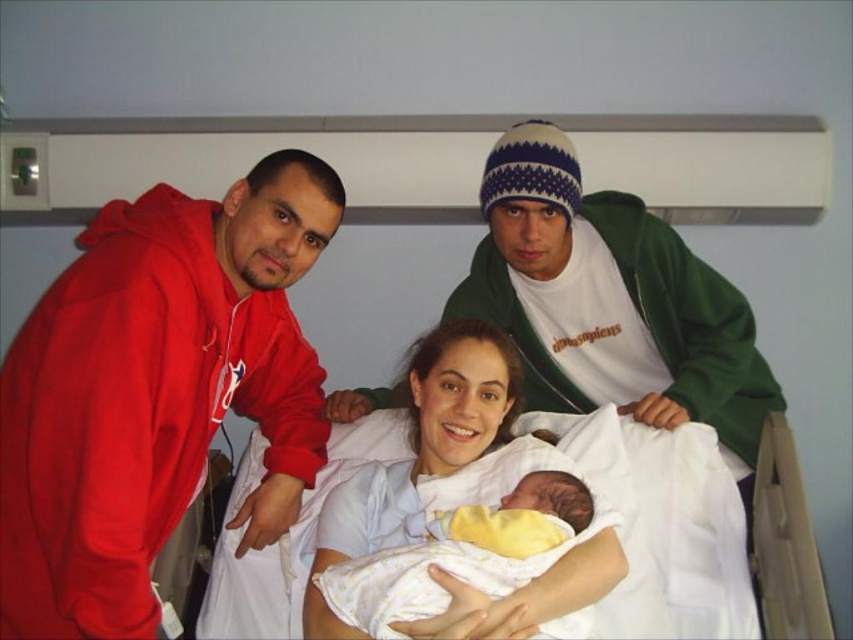
Question: Which point is farther to the camera?

Choices:
 (A) matte red hoodie at left
 (B) white fabric at center
 (C) yellow soft fabric newborn at center

Answer: (B)

Question: Is matte red hoodie at left smaller than yellow soft fabric newborn at center?

Choices:
 (A) yes
 (B) no

Answer: (B)

Question: Is matte red hoodie at left above white fabric at center?

Choices:
 (A) yes
 (B) no

Answer: (A)

Question: Which object is farther from the camera taking this photo?

Choices:
 (A) white fabric at center
 (B) yellow soft fabric newborn at center
 (C) matte red hoodie at left

Answer: (A)

Question: Is matte red hoodie at left thinner than yellow soft fabric newborn at center?

Choices:
 (A) no
 (B) yes

Answer: (A)

Question: Which is nearer to the white fabric at center?

Choices:
 (A) matte red hoodie at left
 (B) yellow soft fabric newborn at center

Answer: (B)